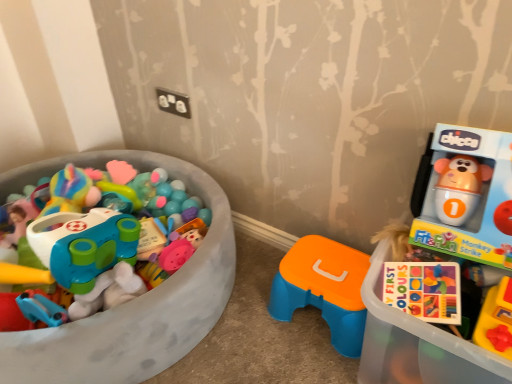
This screenshot has width=512, height=384. Identify the location of matte plastic toy car at left, which appears as the first toy when viewed from the left. (83, 244).

This screenshot has width=512, height=384. What do you see at coordinates (466, 192) in the screenshot?
I see `matte plastic toy at right` at bounding box center [466, 192].

In the scene shown: Measure the distance between matte plastic toy at right and camera.

The distance of matte plastic toy at right from camera is 29.43 inches.

Where is `matte plastic toy car at left, which appears as the first toy when viewed from the left`? This screenshot has width=512, height=384. matte plastic toy car at left, which appears as the first toy when viewed from the left is located at coordinates (83, 244).

Is matte plastic toy car at left, which appears as the first toy when viewed from the left, wider or thinner than orange plastic stool at center, the first toy positioned from the right?

Considering their sizes, matte plastic toy car at left, which appears as the first toy when viewed from the left, looks broader than orange plastic stool at center, the first toy positioned from the right.

From the image's perspective, is matte plastic toy car at left, which appears as the first toy when viewed from the left, on orange plastic stool at center, the first toy positioned from the right?

Yes, from the image's perspective, matte plastic toy car at left, which appears as the first toy when viewed from the left, is above orange plastic stool at center, the first toy positioned from the right.

Can we say matte plastic toy car at left, the 2th toy in the right-to-left sequence, lies outside orange plastic stool at center, the first toy positioned from the right?

matte plastic toy car at left, the 2th toy in the right-to-left sequence, is positioned outside orange plastic stool at center, the first toy positioned from the right.

Considering the positions of points (70, 175) and (277, 273), is point (70, 175) farther from camera compared to point (277, 273)?

That is False.

From the image's perspective, which object appears higher, matte plastic toy at right or matte plastic toy car at left, the 2th toy in the right-to-left sequence?

From the image's view, matte plastic toy car at left, the 2th toy in the right-to-left sequence, is above.

Which point is more forward, [495,186] or [40,236]?

The point [495,186] is closer to the camera.

In the scene shown: Is matte plastic toy at right bigger than orange plastic stool at center, arranged as the second toy when viewed from the left?

Correct, matte plastic toy at right is larger in size than orange plastic stool at center, arranged as the second toy when viewed from the left.

Which of these two, matte plastic toy at right or orange plastic stool at center, arranged as the second toy when viewed from the left, is thinner?

orange plastic stool at center, arranged as the second toy when viewed from the left, is thinner.

Consider the image. Could orange plastic stool at center, arranged as the second toy when viewed from the left, be considered to be inside matte plastic toy at right?

No, orange plastic stool at center, arranged as the second toy when viewed from the left, is located outside of matte plastic toy at right.

Can you confirm if orange plastic stool at center, arranged as the second toy when viewed from the left, is bigger than matte plastic toy at right?

No.

Is point (311, 303) more distant than point (369, 275)?

Yes, it is behind point (369, 275).

Who is shorter, orange plastic stool at center, arranged as the second toy when viewed from the left, or matte plastic toy at right?

With less height is orange plastic stool at center, arranged as the second toy when viewed from the left.

Can matte plastic toy at right be found inside orange plastic stool at center, arranged as the second toy when viewed from the left?

That's incorrect, matte plastic toy at right is not inside orange plastic stool at center, arranged as the second toy when viewed from the left.

Is matte plastic toy car at left, which appears as the first toy when viewed from the left, wider than matte plastic toy at right?

Yes, matte plastic toy car at left, which appears as the first toy when viewed from the left, is wider than matte plastic toy at right.

Considering the sizes of objects matte plastic toy car at left, the 2th toy in the right-to-left sequence, and matte plastic toy at right in the image provided, who is smaller, matte plastic toy car at left, the 2th toy in the right-to-left sequence, or matte plastic toy at right?

Smaller between the two is matte plastic toy at right.

Is matte plastic toy car at left, the 2th toy in the right-to-left sequence, not near matte plastic toy at right?

No.

Does matte plastic toy car at left, which appears as the first toy when viewed from the left, turn towards matte plastic toy at right?

No, matte plastic toy car at left, which appears as the first toy when viewed from the left, does not turn towards matte plastic toy at right.

Based on the photo, from the image's perspective, which object appears higher, orange plastic stool at center, arranged as the second toy when viewed from the left, or matte plastic toy car at left, which appears as the first toy when viewed from the left?

matte plastic toy car at left, which appears as the first toy when viewed from the left.

Between orange plastic stool at center, arranged as the second toy when viewed from the left, and matte plastic toy car at left, the 2th toy in the right-to-left sequence, which one has less height?

With less height is orange plastic stool at center, arranged as the second toy when viewed from the left.

From a real-world perspective, is orange plastic stool at center, the first toy positioned from the right, under matte plastic toy car at left, which appears as the first toy when viewed from the left?

Yes, from a real-world perspective, orange plastic stool at center, the first toy positioned from the right, is under matte plastic toy car at left, which appears as the first toy when viewed from the left.

Who is smaller, orange plastic stool at center, the first toy positioned from the right, or matte plastic toy car at left, the 2th toy in the right-to-left sequence?

orange plastic stool at center, the first toy positioned from the right, is smaller.

Identify the location of toy on the left of orange plastic stool at center, the first toy positioned from the right. The image size is (512, 384). (83, 244).

At what (x,y) coordinates should I click in order to perform the action: click on toyshop in front of the matte plastic toy car at left, the 2th toy in the right-to-left sequence. Please return your answer as a coordinate pair (x, y). This screenshot has width=512, height=384. Looking at the image, I should click on (466, 192).

Based on their spatial positions, is matte plastic toy car at left, the 2th toy in the right-to-left sequence, or orange plastic stool at center, the first toy positioned from the right, further from matte plastic toy at right?

Based on the image, matte plastic toy car at left, the 2th toy in the right-to-left sequence, appears to be further to matte plastic toy at right.

Estimate the real-world distances between objects in this image. Which object is further from matte plastic toy at right, orange plastic stool at center, arranged as the second toy when viewed from the left, or matte plastic toy car at left, which appears as the first toy when viewed from the left?

matte plastic toy car at left, which appears as the first toy when viewed from the left, is further to matte plastic toy at right.

When comparing their distances from matte plastic toy car at left, the 2th toy in the right-to-left sequence, does orange plastic stool at center, the first toy positioned from the right, or matte plastic toy at right seem further?

matte plastic toy at right is positioned further to the anchor matte plastic toy car at left, the 2th toy in the right-to-left sequence.

Estimate the real-world distances between objects in this image. Which object is further from orange plastic stool at center, arranged as the second toy when viewed from the left, matte plastic toy at right or matte plastic toy car at left, the 2th toy in the right-to-left sequence?

The object further to orange plastic stool at center, arranged as the second toy when viewed from the left, is matte plastic toy car at left, the 2th toy in the right-to-left sequence.

Considering their positions, is matte plastic toy car at left, which appears as the first toy when viewed from the left, positioned further to orange plastic stool at center, arranged as the second toy when viewed from the left, than matte plastic toy at right?

The object further to orange plastic stool at center, arranged as the second toy when viewed from the left, is matte plastic toy car at left, which appears as the first toy when viewed from the left.

Which object lies further to the anchor point matte plastic toy car at left, the 2th toy in the right-to-left sequence, matte plastic toy at right or orange plastic stool at center, arranged as the second toy when viewed from the left?

matte plastic toy at right is positioned further to the anchor matte plastic toy car at left, the 2th toy in the right-to-left sequence.

Find the location of a particular element. toy between matte plastic toy car at left, the 2th toy in the right-to-left sequence, and matte plastic toy at right is located at coordinates (324, 288).